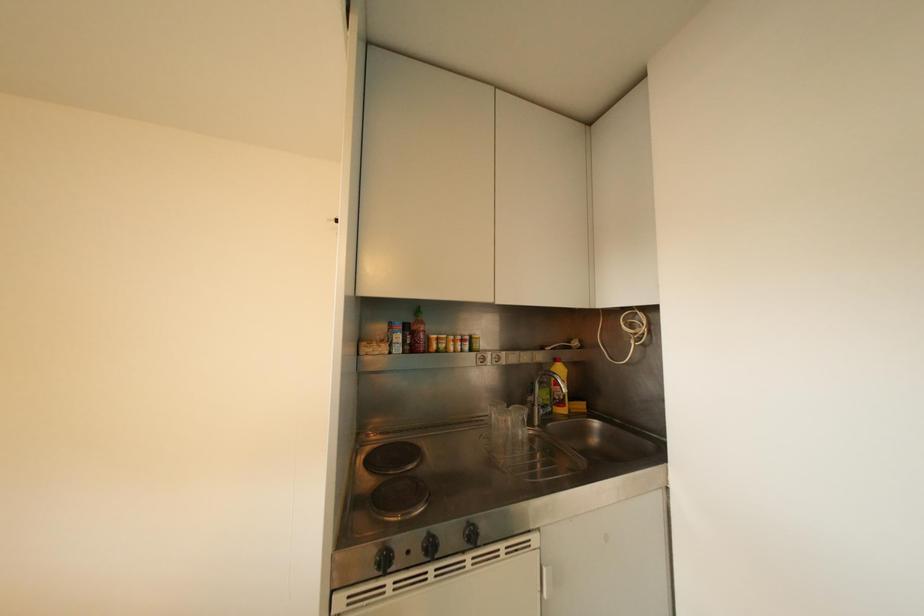
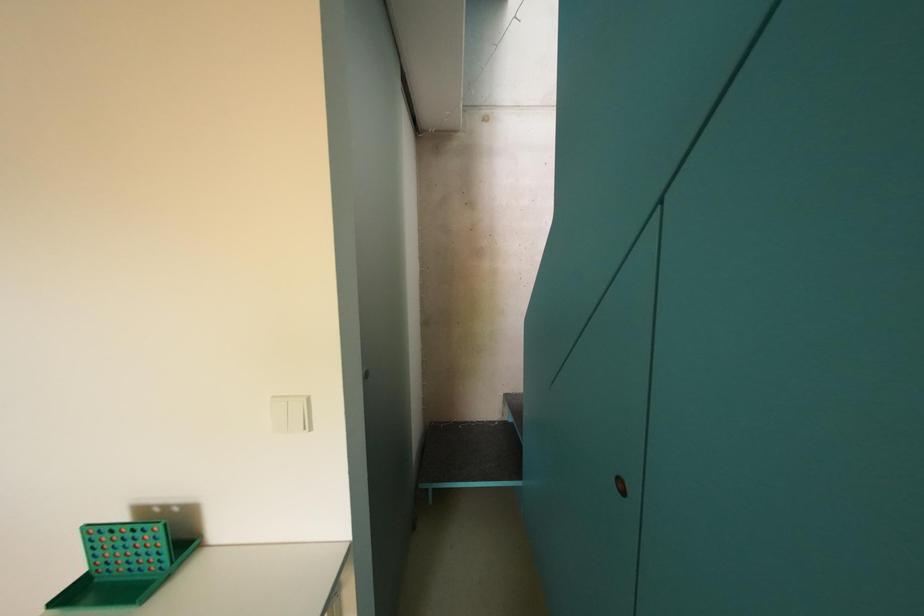
Question: The camera is either moving clockwise (left) or counter-clockwise (right) around the object. The first image is from the beginning of the video and the second image is from the end. Is the camera moving left or right when shooting the video?

Choices:
 (A) Left
 (B) Right

Answer: (A)